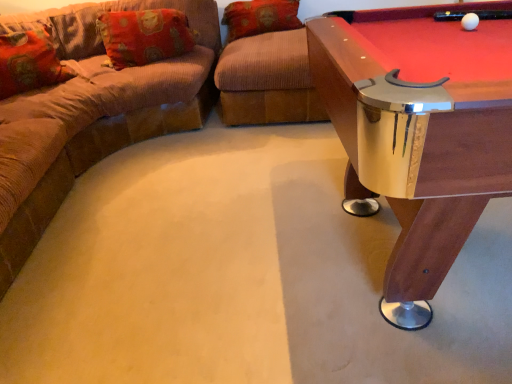
Question: From the image's perspective, does orange fabric pillow at upper left, which is the 2th pillow in right-to-left order, appear lower than brown corduroy couch at left?

Choices:
 (A) no
 (B) yes

Answer: (A)

Question: Does orange fabric pillow at upper left, acting as the second pillow starting from the left, lie behind brown corduroy couch at left?

Choices:
 (A) no
 (B) yes

Answer: (B)

Question: Can you see orange fabric pillow at upper left, acting as the second pillow starting from the left, touching brown corduroy couch at left?

Choices:
 (A) no
 (B) yes

Answer: (A)

Question: Considering the relative positions of orange fabric pillow at upper left, acting as the second pillow starting from the left, and brown corduroy couch at left in the image provided, is orange fabric pillow at upper left, acting as the second pillow starting from the left, to the right of brown corduroy couch at left from the viewer's perspective?

Choices:
 (A) no
 (B) yes

Answer: (B)

Question: From a real-world perspective, is orange fabric pillow at upper left, which is the 2th pillow in right-to-left order, located higher than brown corduroy couch at left?

Choices:
 (A) no
 (B) yes

Answer: (B)

Question: Visually, is orange fabric pillow at upper left, acting as the second pillow starting from the left, positioned to the left or to the right of brown corduroy couch at left?

Choices:
 (A) right
 (B) left

Answer: (A)

Question: Considering the positions of orange fabric pillow at upper left, which is the 2th pillow in right-to-left order, and brown corduroy couch at left in the image, is orange fabric pillow at upper left, which is the 2th pillow in right-to-left order, wider or thinner than brown corduroy couch at left?

Choices:
 (A) thin
 (B) wide

Answer: (A)

Question: Is orange fabric pillow at upper left, acting as the second pillow starting from the left, taller or shorter than brown corduroy couch at left?

Choices:
 (A) tall
 (B) short

Answer: (B)

Question: Is orange fabric pillow at upper left, acting as the second pillow starting from the left, in front of or behind brown corduroy couch at left in the image?

Choices:
 (A) front
 (B) behind

Answer: (B)

Question: In terms of width, does orange corduroy pillow at upper center, the 1th pillow when ordered from right to left, look wider or thinner when compared to floral fabric pillow at left, which appears as the 1th pillow when viewed from the left?

Choices:
 (A) thin
 (B) wide

Answer: (B)

Question: In the image, is orange corduroy pillow at upper center, the 1th pillow when ordered from right to left, positioned in front of or behind floral fabric pillow at left, positioned as the third pillow in right-to-left order?

Choices:
 (A) behind
 (B) front

Answer: (A)

Question: From a real-world perspective, is orange corduroy pillow at upper center, the 1th pillow when ordered from right to left, physically located above or below floral fabric pillow at left, which appears as the 1th pillow when viewed from the left?

Choices:
 (A) below
 (B) above

Answer: (A)

Question: Would you say orange corduroy pillow at upper center, the 1th pillow when ordered from right to left, is to the left or to the right of floral fabric pillow at left, which appears as the 1th pillow when viewed from the left, in the picture?

Choices:
 (A) left
 (B) right

Answer: (B)

Question: Considering the positions of white glossy ball at upper right and floral fabric pillow at left, positioned as the third pillow in right-to-left order, in the image, is white glossy ball at upper right wider or thinner than floral fabric pillow at left, positioned as the third pillow in right-to-left order,?

Choices:
 (A) wide
 (B) thin

Answer: (B)

Question: Does point (471, 24) appear closer or farther from the camera than point (10, 39)?

Choices:
 (A) closer
 (B) farther

Answer: (A)